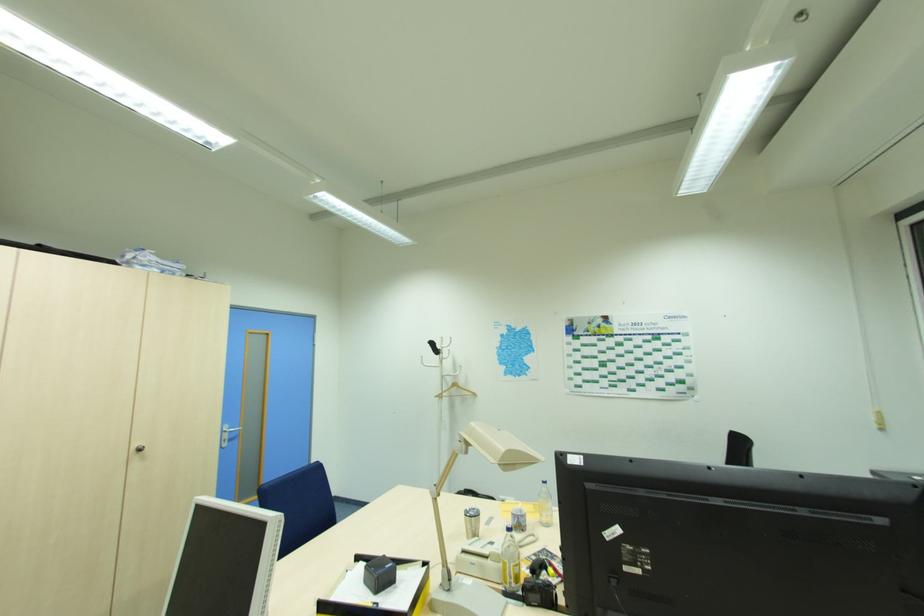
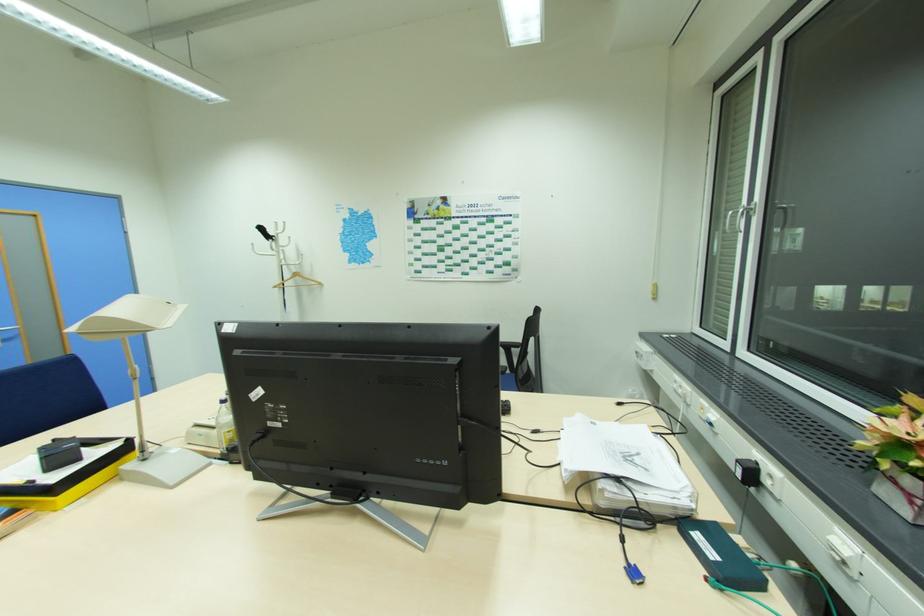
Question: Based on the continuous images, in which direction is the camera rotating? Reply with the corresponding letter.

Choices:
 (A) Left
 (B) Right
 (C) Up
 (D) Down

Answer: (D)